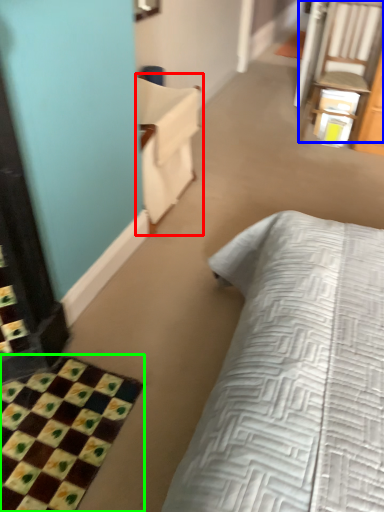
Question: Which object is the closest to the armchair (highlighted by a red box)? Choose among these: chair (highlighted by a blue box) or bath mat (highlighted by a green box).

Choices:
 (A) chair
 (B) bath mat

Answer: (B)